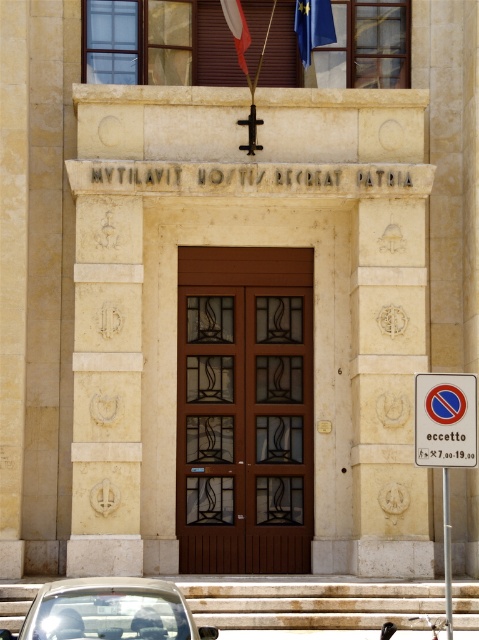
From the picture: Is matte black car at lower center to the right of white plastic sign at right from the viewer's perspective?

No, matte black car at lower center is not to the right of white plastic sign at right.

From the picture: Is matte black car at lower center below white plastic sign at right?

Yes, matte black car at lower center is below white plastic sign at right.

Which is behind, point (141, 634) or point (448, 515)?

The point (448, 515) is more distant.

You are a GUI agent. You are given a task and a screenshot of the screen. Output one action in this format:
    pyautogui.click(x=<x>, y=<y>)
    Task: Click on the matte black car at lower center
    This screenshot has width=479, height=640.
    Given the screenshot: What is the action you would take?
    pyautogui.click(x=110, y=611)

Can you confirm if brown wooden door at center is thinner than blue fabric flag at upper center?

In fact, brown wooden door at center might be wider than blue fabric flag at upper center.

Is brown wooden door at center wider than blue fabric flag at upper center?

Yes.

Describe the element at coordinates (244, 410) in the screenshot. Image resolution: width=479 pixels, height=640 pixels. I see `brown wooden door at center` at that location.

You are a GUI agent. You are given a task and a screenshot of the screen. Output one action in this format:
    pyautogui.click(x=<x>, y=<y>)
    Task: Click on the brown wooden door at center
    This screenshot has width=479, height=640.
    Given the screenshot: What is the action you would take?
    pyautogui.click(x=244, y=410)

Can you confirm if white plastic sign at lower right is positioned to the right of blue fabric flag at upper center?

Correct, you'll find white plastic sign at lower right to the right of blue fabric flag at upper center.

From the picture: Can you confirm if white plastic sign at lower right is taller than blue fabric flag at upper center?

Incorrect, white plastic sign at lower right's height is not larger of blue fabric flag at upper center's.

Does point (444, 465) lie behind point (301, 49)?

No, (444, 465) is in front of (301, 49).

Find the location of a particular element. The image size is (479, 640). white plastic sign at lower right is located at coordinates (444, 419).